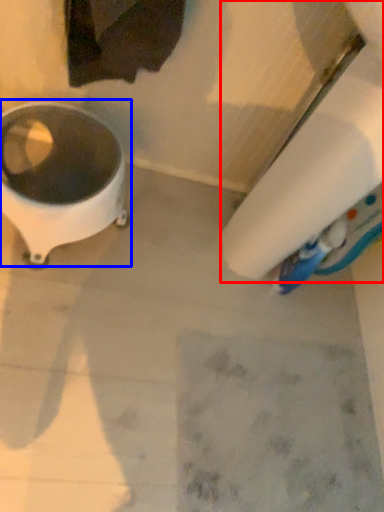
Question: Which of the following is the closest to the observer, toilet paper (highlighted by a red box) or waste container (highlighted by a blue box)?

Choices:
 (A) toilet paper
 (B) waste container

Answer: (A)